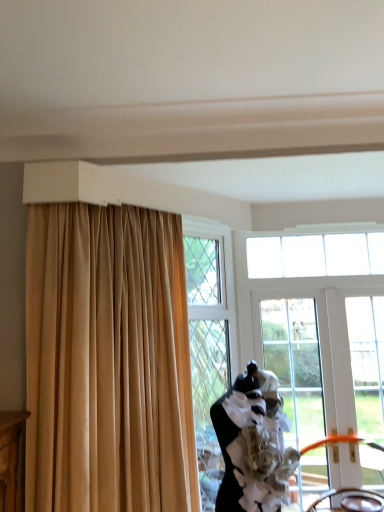
Describe the element at coordinates (340, 442) in the screenshot. This screenshot has width=384, height=512. I see `orange plastic chair at lower right, which ranks as the 2th chair in front-to-back order` at that location.

What do you see at coordinates (107, 361) in the screenshot?
I see `beige fabric curtain at upper left` at bounding box center [107, 361].

Measure the distance between brown leather chair at lower right, the first chair from the front, and camera.

The distance of brown leather chair at lower right, the first chair from the front, from camera is 2.50 meters.

I want to click on white plastic door at right, which is the second window in top-to-bottom order, so tap(367, 362).

Where is `orange plastic chair at lower right, the first chair when ordered from back to front`? The image size is (384, 512). orange plastic chair at lower right, the first chair when ordered from back to front is located at coordinates (340, 442).

From their relative heights in the image, would you say brown leather chair at lower right, the 2th chair in the back-to-front sequence, is taller or shorter than clear glass door at center?

In the image, brown leather chair at lower right, the 2th chair in the back-to-front sequence, appears to be shorter than clear glass door at center.

Is brown leather chair at lower right, the first chair from the front, directly adjacent to clear glass door at center?

No, brown leather chair at lower right, the first chair from the front, is not next to clear glass door at center.

Which of these two, brown leather chair at lower right, the 2th chair in the back-to-front sequence, or clear glass door at center, is bigger?

Bigger between the two is clear glass door at center.

Is white plastic door at right, which is the second window in top-to-bottom order, facing away from black matte dress form at center?

That's not correct — white plastic door at right, which is the second window in top-to-bottom order, is not looking away from black matte dress form at center.

How much distance is there between white plastic door at right, the first window in the bottom-to-top sequence, and black matte dress form at center?

A distance of 1.10 meters exists between white plastic door at right, the first window in the bottom-to-top sequence, and black matte dress form at center.

From the image's perspective, would you say white plastic door at right, the first window in the bottom-to-top sequence, is shown under black matte dress form at center?

Incorrect, from the image's perspective, white plastic door at right, the first window in the bottom-to-top sequence, is higher than black matte dress form at center.

Which is behind, point (279, 249) or point (279, 449)?

The point (279, 249) is more distant.

From the image's perspective, which is above, clear glass window at upper center, arranged as the 1th window when viewed from the top, or black matte dress form at center?

clear glass window at upper center, arranged as the 1th window when viewed from the top.

From a real-world perspective, relative to black matte dress form at center, is clear glass window at upper center, which appears as the second window when ordered from the bottom, vertically above or below?

clear glass window at upper center, which appears as the second window when ordered from the bottom, is situated higher than black matte dress form at center in the real world.

Locate an element on the screen. window that is the 2nd object located above the black matte dress form at center (from the image's perspective) is located at coordinates (315, 255).

Considering the positions of objects black matte dress form at center and orange plastic chair at lower right, the first chair when ordered from back to front, in the image provided, who is more to the right, black matte dress form at center or orange plastic chair at lower right, the first chair when ordered from back to front,?

From the viewer's perspective, orange plastic chair at lower right, the first chair when ordered from back to front, appears more on the right side.

Is black matte dress form at center next to orange plastic chair at lower right, which ranks as the 2th chair in front-to-back order, and touching it?

black matte dress form at center and orange plastic chair at lower right, which ranks as the 2th chair in front-to-back order, are clearly separated.

From a real-world perspective, between black matte dress form at center and orange plastic chair at lower right, the first chair when ordered from back to front, who is vertically lower?

orange plastic chair at lower right, the first chair when ordered from back to front.

Can orange plastic chair at lower right, which ranks as the 2th chair in front-to-back order, be found inside black matte dress form at center?

Actually, orange plastic chair at lower right, which ranks as the 2th chair in front-to-back order, is outside black matte dress form at center.

Which of these two, orange plastic chair at lower right, the first chair when ordered from back to front, or beige fabric curtain at upper left, is wider?

Wider between the two is beige fabric curtain at upper left.

From a real-world perspective, which object stands above the other?

beige fabric curtain at upper left is physically above.

Is orange plastic chair at lower right, the first chair when ordered from back to front, smaller than beige fabric curtain at upper left?

Yes.

Considering the relative positions of orange plastic chair at lower right, the first chair when ordered from back to front, and beige fabric curtain at upper left in the image provided, is orange plastic chair at lower right, the first chair when ordered from back to front, in front of beige fabric curtain at upper left?

No, orange plastic chair at lower right, the first chair when ordered from back to front, is further to the viewer.

You are a GUI agent. You are given a task and a screenshot of the screen. Output one action in this format:
    pyautogui.click(x=<x>, y=<y>)
    Task: Click on the window screen on the right side of black matte dress form at center
    Image resolution: width=384 pixels, height=512 pixels.
    Given the screenshot: What is the action you would take?
    pyautogui.click(x=295, y=364)

What's the angular difference between black matte dress form at center and clear glass door at center's facing directions?

58.3 degrees.

Considering the positions of point (244, 383) and point (286, 339), is point (244, 383) closer or farther from the camera than point (286, 339)?

Point (244, 383) appears to be closer to the viewer than point (286, 339).

Relative to clear glass door at center, is black matte dress form at center in front or behind?

In the image, black matte dress form at center appears in front of clear glass door at center.

Is orange plastic chair at lower right, which ranks as the 2th chair in front-to-back order, not inside clear glass door at center?

No, orange plastic chair at lower right, which ranks as the 2th chair in front-to-back order, is not entirely external to clear glass door at center.

Is point (338, 441) positioned after point (292, 404)?

No, it is not.

Is orange plastic chair at lower right, the first chair when ordered from back to front, far from clear glass door at center?

That's not correct — orange plastic chair at lower right, the first chair when ordered from back to front, is a little close to clear glass door at center.

Where is `window screen behind the orange plastic chair at lower right, which ranks as the 2th chair in front-to-back order`? window screen behind the orange plastic chair at lower right, which ranks as the 2th chair in front-to-back order is located at coordinates (295, 364).

Locate an element on the screen. This screenshot has height=512, width=384. window screen that is on the left side of brown leather chair at lower right, the first chair from the front is located at coordinates (295, 364).

The height and width of the screenshot is (512, 384). I want to click on woman that appears below the white plastic door at right, the first window in the bottom-to-top sequence (from the image's perspective), so click(x=253, y=444).

In the scene shown: Looking at the image, which one is located closer to brown leather chair at lower right, the first chair from the front, beige fabric curtain at upper left or clear glass window at upper center, arranged as the 1th window when viewed from the top?

Among the two, clear glass window at upper center, arranged as the 1th window when viewed from the top, is located nearer to brown leather chair at lower right, the first chair from the front.

Estimate the real-world distances between objects in this image. Which object is closer to clear glass door at center, beige fabric curtain at upper left or black matte dress form at center?

black matte dress form at center lies closer to clear glass door at center than the other object.

When comparing their distances from brown leather chair at lower right, the first chair from the front, does orange plastic chair at lower right, the first chair when ordered from back to front, or white plastic door at right, which is the second window in top-to-bottom order, seem further?

white plastic door at right, which is the second window in top-to-bottom order, is further to brown leather chair at lower right, the first chair from the front.

Based on their spatial positions, is white plastic door at right, which is the second window in top-to-bottom order, or orange plastic chair at lower right, which ranks as the 2th chair in front-to-back order, further from clear glass door at center?

orange plastic chair at lower right, which ranks as the 2th chair in front-to-back order, is further to clear glass door at center.

Based on their spatial positions, is brown leather chair at lower right, the 2th chair in the back-to-front sequence, or clear glass door at center closer to white plastic door at right, the first window in the bottom-to-top sequence?

clear glass door at center lies closer to white plastic door at right, the first window in the bottom-to-top sequence, than the other object.

Estimate the real-world distances between objects in this image. Which object is further from brown leather chair at lower right, the first chair from the front, clear glass door at center or orange plastic chair at lower right, the first chair when ordered from back to front?

Among the two, clear glass door at center is located further to brown leather chair at lower right, the first chair from the front.

When comparing their distances from white plastic door at right, which is the second window in top-to-bottom order, does beige fabric curtain at upper left or brown leather chair at lower right, the first chair from the front, seem further?

The object further to white plastic door at right, which is the second window in top-to-bottom order, is beige fabric curtain at upper left.

When comparing their distances from white plastic door at right, the first window in the bottom-to-top sequence, does brown leather chair at lower right, the first chair from the front, or clear glass window at upper center, arranged as the 1th window when viewed from the top, seem further?

The object further to white plastic door at right, the first window in the bottom-to-top sequence, is brown leather chair at lower right, the first chair from the front.

Identify the location of chair that lies between clear glass door at center and brown leather chair at lower right, the 2th chair in the back-to-front sequence, from top to bottom. (340, 442).

In order to click on woman between clear glass window at upper center, which appears as the second window when ordered from the bottom, and brown leather chair at lower right, the 2th chair in the back-to-front sequence, from top to bottom in this screenshot , I will do point(253,444).

Where is `chair between black matte dress form at center and white plastic door at right, the first window in the bottom-to-top sequence, in the front-back direction`? The width and height of the screenshot is (384, 512). chair between black matte dress form at center and white plastic door at right, the first window in the bottom-to-top sequence, in the front-back direction is located at coordinates (353, 500).

This screenshot has height=512, width=384. Identify the location of window between black matte dress form at center and orange plastic chair at lower right, which ranks as the 2th chair in front-to-back order, from front to back. (367, 362).